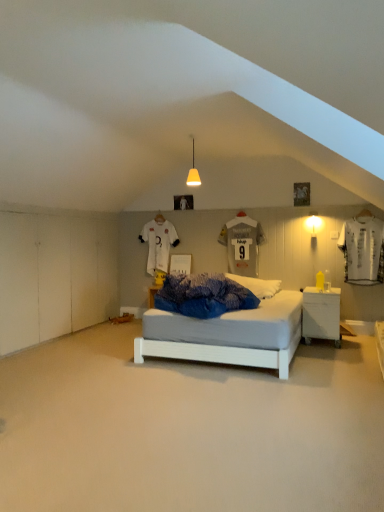
Locate an element on the screen. This screenshot has width=384, height=512. vacant area on top of matte yellow pendant at center, which is counted as the first light fixture, starting from the left (from a real-world perspective) is located at coordinates (201, 133).